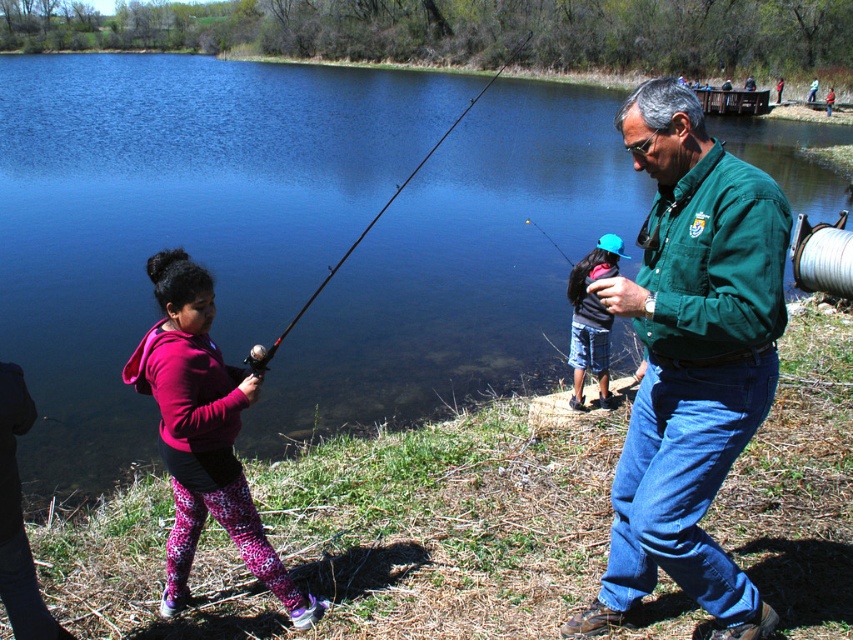
Who is higher up, green cotton shirt at center or blue denim shorts at lower center?

blue denim shorts at lower center

Is green cotton shirt at center to the right of blue denim shorts at lower center from the viewer's perspective?

Incorrect, green cotton shirt at center is not on the right side of blue denim shorts at lower center.

You are a GUI agent. You are given a task and a screenshot of the screen. Output one action in this format:
    pyautogui.click(x=<x>, y=<y>)
    Task: Click on the green cotton shirt at center
    
    Given the screenshot: What is the action you would take?
    pyautogui.click(x=691, y=358)

Is matte pink hoodie at center smaller than black matte fishing pole at center?

Correct, matte pink hoodie at center occupies less space than black matte fishing pole at center.

The height and width of the screenshot is (640, 853). I want to click on matte pink hoodie at center, so click(202, 433).

Is point (502, 278) positioned behind point (311, 301)?

Yes, it is.

Is blue water at center bigger than black matte fishing pole at center?

Indeed, blue water at center has a larger size compared to black matte fishing pole at center.

The height and width of the screenshot is (640, 853). What do you see at coordinates (177, 216) in the screenshot? I see `blue water at center` at bounding box center [177, 216].

In order to click on blue water at center in this screenshot , I will do `click(177, 216)`.